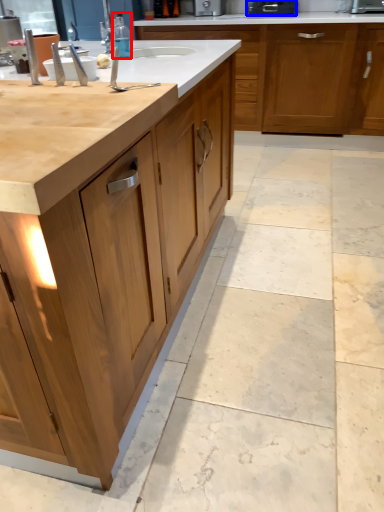
Question: Among these objects, which one is farthest to the camera, bottle (highlighted by a red box) or appliance (highlighted by a blue box)?

Choices:
 (A) bottle
 (B) appliance

Answer: (B)